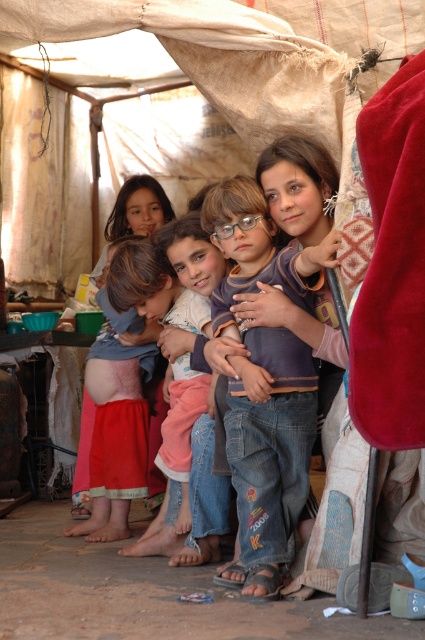
Question: Does denim jeans at center appear under red cotton dress at lower left?

Choices:
 (A) no
 (B) yes

Answer: (A)

Question: Does denim jeans at center lie behind red cotton dress at lower left?

Choices:
 (A) yes
 (B) no

Answer: (B)

Question: Among these points, which one is nearest to the camera?

Choices:
 (A) (201, 499)
 (B) (246, 531)
 (C) (102, 337)

Answer: (B)

Question: Is denim jeans at center bigger than red cotton dress at lower left?

Choices:
 (A) no
 (B) yes

Answer: (B)

Question: Which point appears closest to the camera in this image?

Choices:
 (A) (181, 332)
 (B) (234, 193)
 (C) (96, 422)

Answer: (B)

Question: Which point is closer to the camera?

Choices:
 (A) (277, 484)
 (B) (65, 534)
 (C) (221, 456)

Answer: (A)